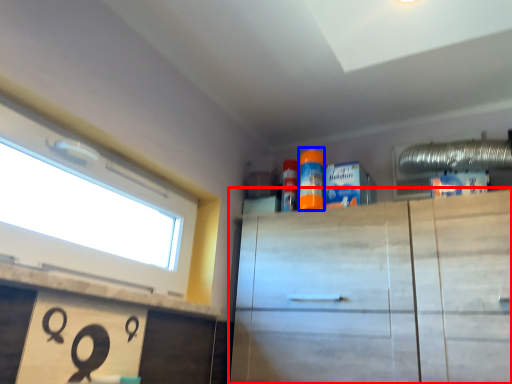
Question: Which object appears closest to the camera in this image, cabinetry (highlighted by a red box) or cleaning product (highlighted by a blue box)?

Choices:
 (A) cabinetry
 (B) cleaning product

Answer: (A)